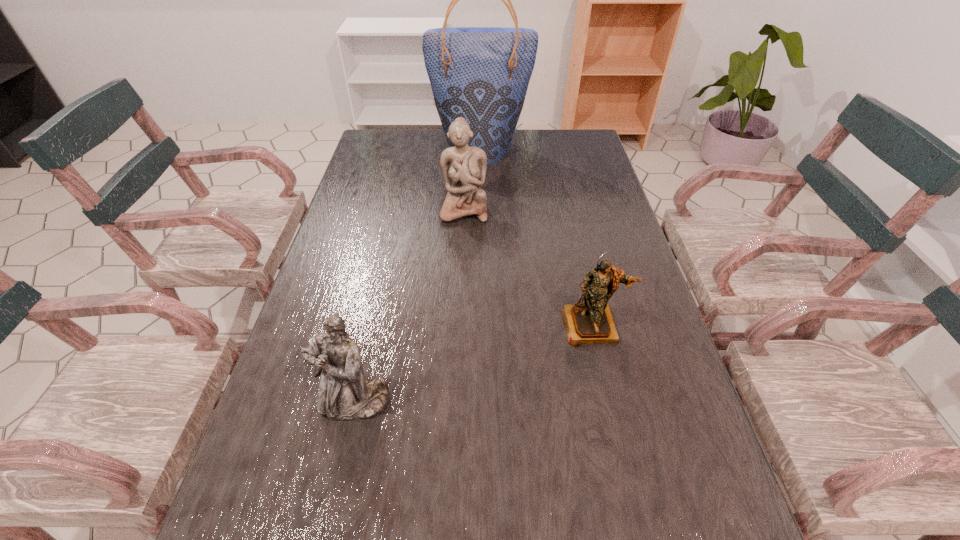
Locate an element on the screen. The image size is (960, 540). the tallest object is located at coordinates (482, 74).

Where is `shopping bag`? The image size is (960, 540). shopping bag is located at coordinates (482, 74).

At what (x,y) coordinates should I click in order to perform the action: click on the second figurine from right to left. Please return your answer as a coordinate pair (x, y). Looking at the image, I should click on (464, 167).

What are the coordinates of `the farthest figurine` in the screenshot? It's located at (464, 167).

The height and width of the screenshot is (540, 960). I want to click on the nearest figurine, so click(344, 394).

Where is `the nearest object`? The height and width of the screenshot is (540, 960). the nearest object is located at coordinates (344, 394).

Identify the location of the rightmost figurine. (590, 321).

Where is `the second farthest figurine`? Image resolution: width=960 pixels, height=540 pixels. the second farthest figurine is located at coordinates (590, 321).

Locate an element on the screen. The image size is (960, 540). vacant space located on the left of the farthest object is located at coordinates (380, 149).

Find the location of a particular element. vacant space situated 0.320m on the front-facing side of the second farthest object is located at coordinates (460, 309).